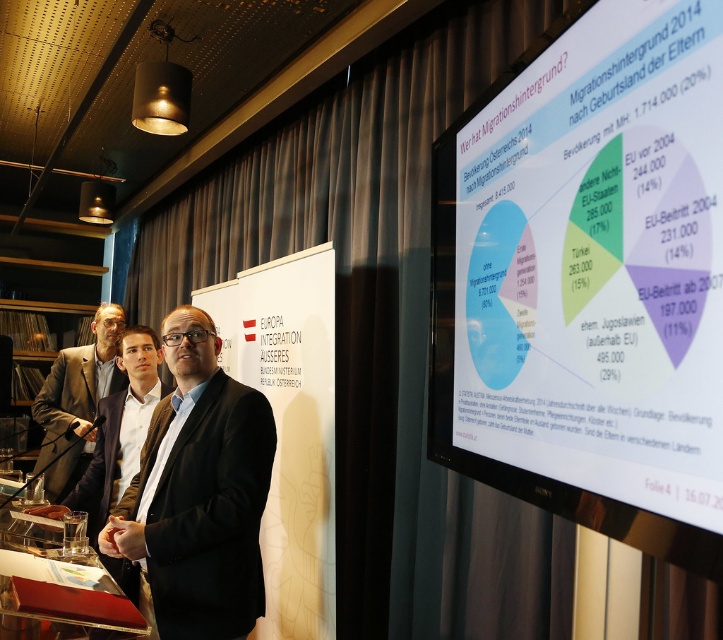
Question: Which point is farther to the camera?

Choices:
 (A) white glossy projection screen at upper right
 (B) matte black suit at left
 (C) dark brown suit at center
 (D) black matte suit at center

Answer: (B)

Question: Which point is farther from the camera taking this photo?

Choices:
 (A) (140, 412)
 (B) (166, 456)

Answer: (A)

Question: Which object is the closest to the matte black suit at left?

Choices:
 (A) black matte suit at center
 (B) dark brown suit at center
 (C) white glossy projection screen at upper right

Answer: (B)

Question: Is dark brown suit at center to the right of matte black suit at left from the viewer's perspective?

Choices:
 (A) no
 (B) yes

Answer: (B)

Question: Can you confirm if black matte suit at center is bigger than dark brown suit at center?

Choices:
 (A) yes
 (B) no

Answer: (B)

Question: Does black matte suit at center have a greater width compared to matte black suit at left?

Choices:
 (A) no
 (B) yes

Answer: (A)